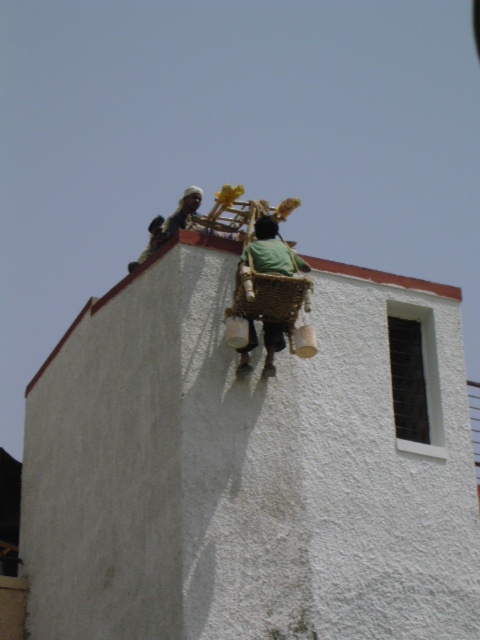
Question: Which point is farther to the camera?

Choices:
 (A) (182, 227)
 (B) (280, 257)

Answer: (A)

Question: Which of the following is the farthest from the observer?

Choices:
 (A) green woven basket at upper center
 (B) light brown wicker basket at upper center

Answer: (B)

Question: Is green woven basket at upper center wider than light brown wicker basket at upper center?

Choices:
 (A) yes
 (B) no

Answer: (B)

Question: Observing the image, what is the correct spatial positioning of green woven basket at upper center in reference to light brown wicker basket at upper center?

Choices:
 (A) left
 (B) right

Answer: (B)

Question: Is green woven basket at upper center above light brown wicker basket at upper center?

Choices:
 (A) no
 (B) yes

Answer: (A)